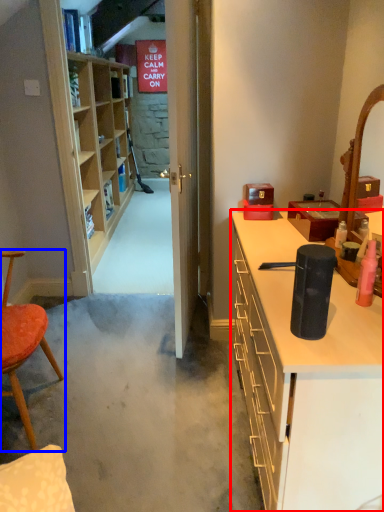
Question: Which point is further to the camera, cabinetry (highlighted by a red box) or chair (highlighted by a blue box)?

Choices:
 (A) cabinetry
 (B) chair

Answer: (B)